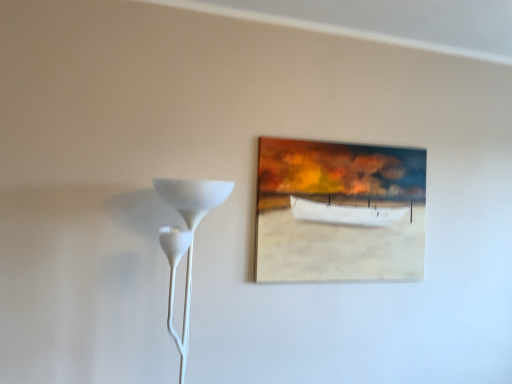
What do you see at coordinates (339, 212) in the screenshot? I see `oil painting boat at upper center` at bounding box center [339, 212].

Where is `oil painting boat at upper center`? Image resolution: width=512 pixels, height=384 pixels. oil painting boat at upper center is located at coordinates (339, 212).

Describe the element at coordinates (191, 225) in the screenshot. Image resolution: width=512 pixels, height=384 pixels. I see `white matte floor lamp at left` at that location.

What is the approximate height of white matte floor lamp at left?

white matte floor lamp at left is 29.72 inches tall.

Locate an element on the screen. Image resolution: width=512 pixels, height=384 pixels. white matte floor lamp at left is located at coordinates (191, 225).

Find the location of a particular element. oil painting boat at upper center is located at coordinates (339, 212).

Between oil painting boat at upper center and white matte floor lamp at left, which one appears on the right side from the viewer's perspective?

oil painting boat at upper center.

Is oil painting boat at upper center positioned in front of white matte floor lamp at left?

No.

Is point (382, 195) behind point (229, 189)?

Yes, point (382, 195) is farther from viewer.

From the image's perspective, is oil painting boat at upper center above or below white matte floor lamp at left?

From the image's perspective, oil painting boat at upper center appears above white matte floor lamp at left.

From a real-world perspective, relative to white matte floor lamp at left, is oil painting boat at upper center vertically above or below?

oil painting boat at upper center is above white matte floor lamp at left.

Considering the sizes of oil painting boat at upper center and white matte floor lamp at left in the image, is oil painting boat at upper center wider or thinner than white matte floor lamp at left?

oil painting boat at upper center is thinner than white matte floor lamp at left.

Who is shorter, oil painting boat at upper center or white matte floor lamp at left?

oil painting boat at upper center is shorter.

Based on their sizes in the image, would you say oil painting boat at upper center is bigger or smaller than white matte floor lamp at left?

Clearly, oil painting boat at upper center is smaller in size than white matte floor lamp at left.

Can we say oil painting boat at upper center lies outside white matte floor lamp at left?

That's correct, oil painting boat at upper center is outside of white matte floor lamp at left.

Based on the photo, is there a large distance between oil painting boat at upper center and white matte floor lamp at left?

No, oil painting boat at upper center is in close proximity to white matte floor lamp at left.

Is oil painting boat at upper center oriented away from white matte floor lamp at left?

No, oil painting boat at upper center's orientation is not away from white matte floor lamp at left.

Can you tell me how much oil painting boat at upper center and white matte floor lamp at left differ in facing direction?

The angular difference between oil painting boat at upper center and white matte floor lamp at left is 1.15 degrees.

How far apart are oil painting boat at upper center and white matte floor lamp at left?

oil painting boat at upper center and white matte floor lamp at left are 23.59 inches apart.

I want to click on picture frame behind the white matte floor lamp at left, so click(339, 212).

Does white matte floor lamp at left appear on the left side of oil painting boat at upper center?

Yes.

Is white matte floor lamp at left further to the viewer compared to oil painting boat at upper center?

No, white matte floor lamp at left is in front of oil painting boat at upper center.

Considering the points (225, 191) and (334, 260), which point is behind, point (225, 191) or point (334, 260)?

The point (334, 260) is farther.

From the image's perspective, is white matte floor lamp at left beneath oil painting boat at upper center?

Indeed, from the image's perspective, white matte floor lamp at left is shown beneath oil painting boat at upper center.

From a real-world perspective, between white matte floor lamp at left and oil painting boat at upper center, who is vertically lower?

In real-world perspective, white matte floor lamp at left is lower.

Looking at this image, considering the sizes of objects white matte floor lamp at left and oil painting boat at upper center in the image provided, who is thinner, white matte floor lamp at left or oil painting boat at upper center?

oil painting boat at upper center is thinner.

Is white matte floor lamp at left shorter than oil painting boat at upper center?

No.

Who is smaller, white matte floor lamp at left or oil painting boat at upper center?

Smaller between the two is oil painting boat at upper center.

Is oil painting boat at upper center surrounded by white matte floor lamp at left?

No, oil painting boat at upper center is not inside white matte floor lamp at left.

Are white matte floor lamp at left and oil painting boat at upper center located far from each other?

white matte floor lamp at left is near oil painting boat at upper center, not far away.

Is oil painting boat at upper center at the back of white matte floor lamp at left?

No.

Find the location of a particular element. The width and height of the screenshot is (512, 384). picture frame on the right of the white matte floor lamp at left is located at coordinates (339, 212).

The image size is (512, 384). Find the location of `picture frame behind the white matte floor lamp at left`. picture frame behind the white matte floor lamp at left is located at coordinates (339, 212).

Identify the location of picture frame on the right of white matte floor lamp at left. (339, 212).